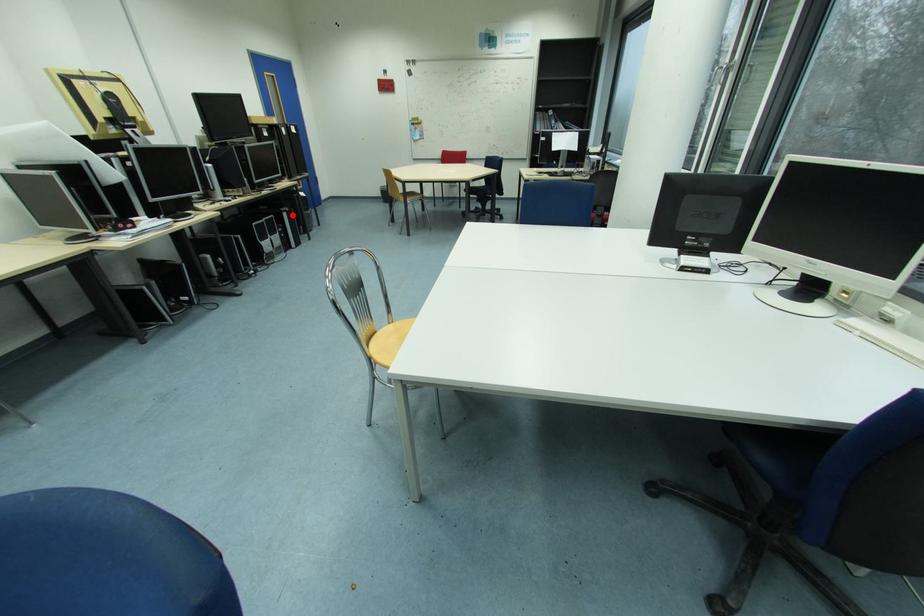
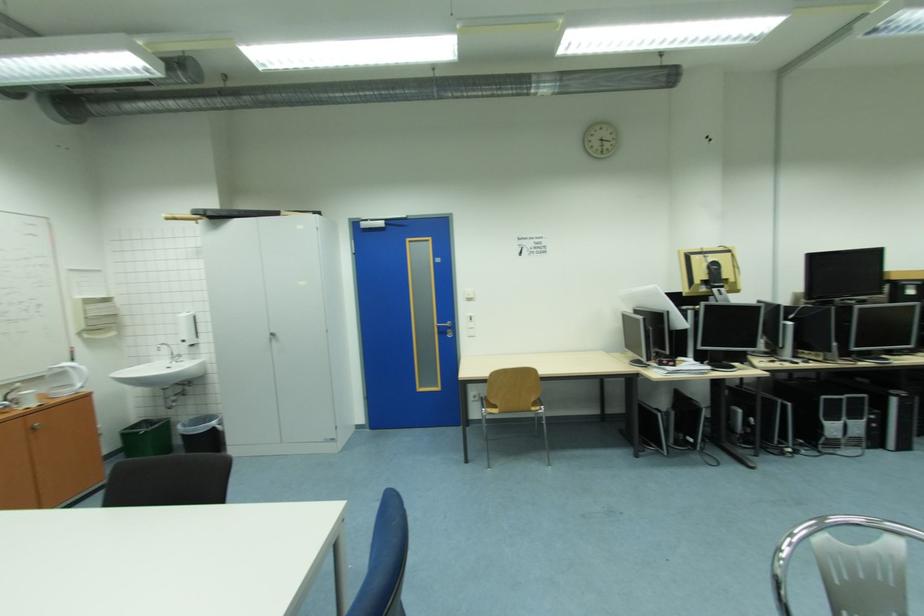
Question: I am providing you with two images of the same scene from different viewpoints. Image1 has a red point marked. In image2, the corresponding 3D location appears at what relative position? Reply with the corresponding letter.

Choices:
 (A) Closer
 (B) Farther

Answer: (A)